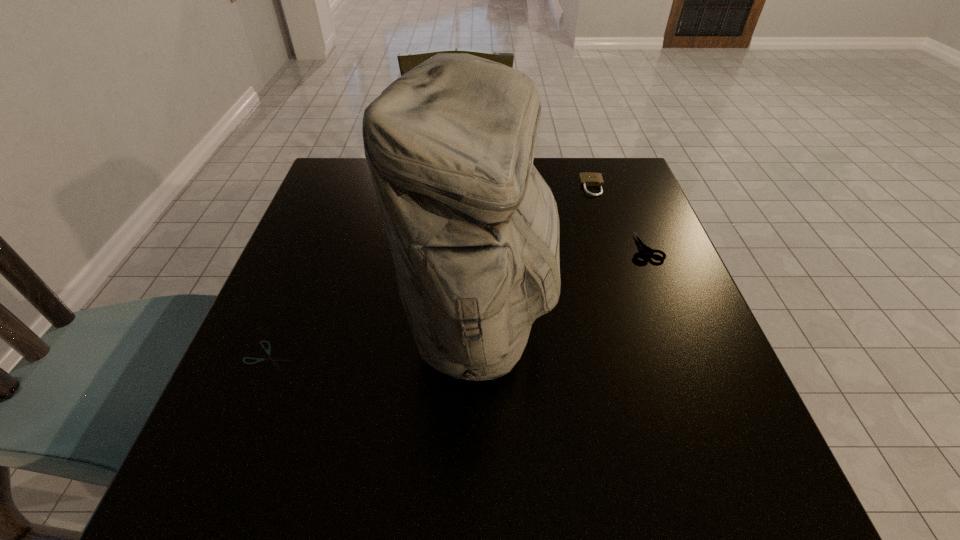
Identify the location of free point at the far left corner. click(x=317, y=204).

Identify the location of vacant space at the near left corner of the desktop. (223, 489).

You are a GUI agent. You are given a task and a screenshot of the screen. Output one action in this format:
    pyautogui.click(x=<x>, y=<y>)
    Task: Click on the vacant region at the far right corner of the desktop
    This screenshot has width=960, height=540.
    Given the screenshot: What is the action you would take?
    pyautogui.click(x=619, y=186)

This screenshot has height=540, width=960. Find the location of `vacant area at the near right corner of the desktop`. vacant area at the near right corner of the desktop is located at coordinates (712, 509).

In order to click on free spot between the backpack and the farther shears in this screenshot , I will do pyautogui.click(x=563, y=286).

You are a GUI agent. You are given a task and a screenshot of the screen. Output one action in this format:
    pyautogui.click(x=<x>, y=<y>)
    Task: Click on the free area in between the second shortest object and the backpack
    
    Given the screenshot: What is the action you would take?
    pyautogui.click(x=563, y=286)

This screenshot has height=540, width=960. I want to click on empty location between the third shortest object and the third tallest object, so click(619, 218).

At what (x,y) coordinates should I click in order to perform the action: click on free space between the third object from right to left and the rightmost object. Please return your answer as a coordinate pair (x, y). Looking at the image, I should click on (563, 286).

Find the location of a particular element. empty space that is in between the second object from left to right and the rightmost object is located at coordinates (563, 286).

You are a GUI agent. You are given a task and a screenshot of the screen. Output one action in this format:
    pyautogui.click(x=<x>, y=<y>)
    Task: Click on the free area in between the nearer shears and the second object from left to right
    
    Given the screenshot: What is the action you would take?
    pyautogui.click(x=374, y=340)